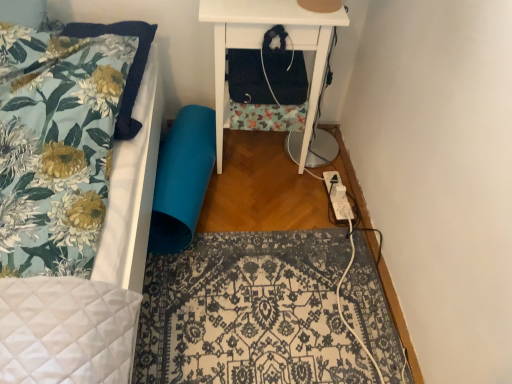
At what (x,y) coordinates should I click in order to perform the action: click on blank space situated above floral fabric pillow at upper left (from a real-world perspective). Please return your answer as a coordinate pair (x, y). The height and width of the screenshot is (384, 512). Looking at the image, I should click on (66, 62).